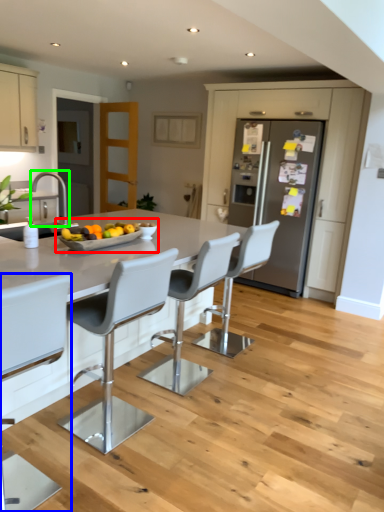
Question: Considering the real-world distances, which object is farthest from fruit dish (highlighted by a red box)? chair (highlighted by a blue box) or silver (highlighted by a green box)?

Choices:
 (A) chair
 (B) silver

Answer: (B)